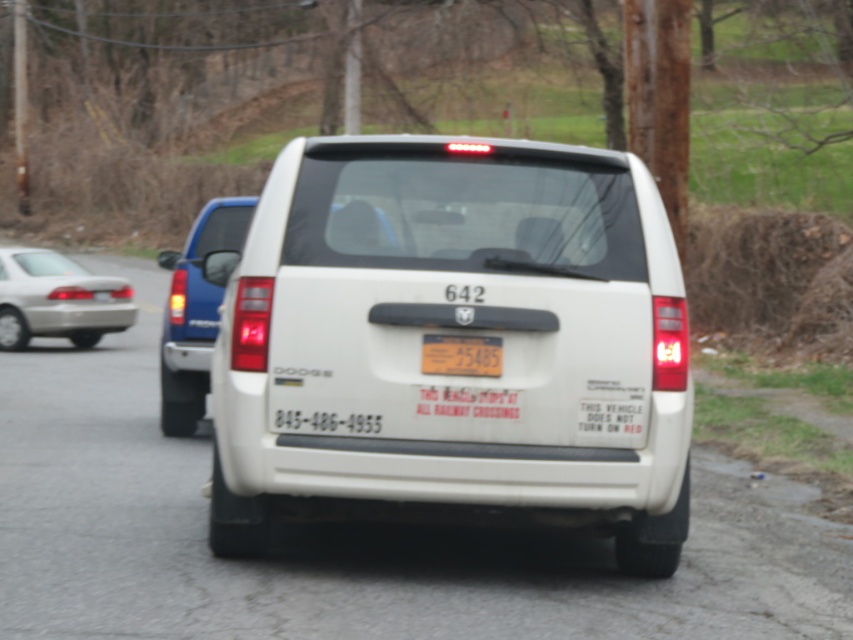
Question: Which is farther from the matte white minivan at left?

Choices:
 (A) white matte pickup truck at center
 (B) white matte minivan at center
 (C) metallic reflective license plate at center

Answer: (C)

Question: Can you confirm if matte white minivan at left is positioned below metallic reflective license plate at center?

Choices:
 (A) yes
 (B) no

Answer: (B)

Question: Can you confirm if silver metallic sedan at left is positioned to the right of metallic reflective license plate at center?

Choices:
 (A) no
 (B) yes

Answer: (A)

Question: Does matte white minivan at left appear under metallic reflective license plate at center?

Choices:
 (A) no
 (B) yes

Answer: (A)

Question: Which point is farther to the camera?

Choices:
 (A) (476, 356)
 (B) (532, 209)
 (C) (184, 253)

Answer: (C)

Question: Among these points, which one is farthest from the camera?

Choices:
 (A) (200, 412)
 (B) (437, 346)
 (C) (250, 291)
 (D) (186, 262)

Answer: (A)